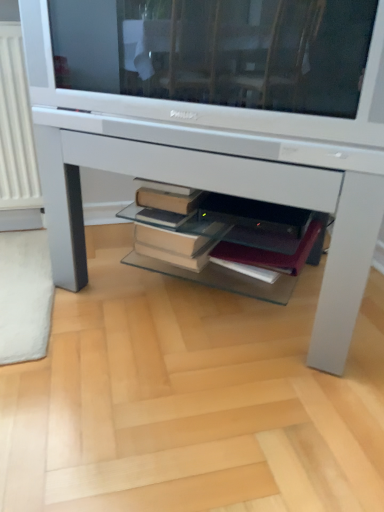
Find the location of `free spot in front of white glossy desk at center`. free spot in front of white glossy desk at center is located at coordinates (191, 403).